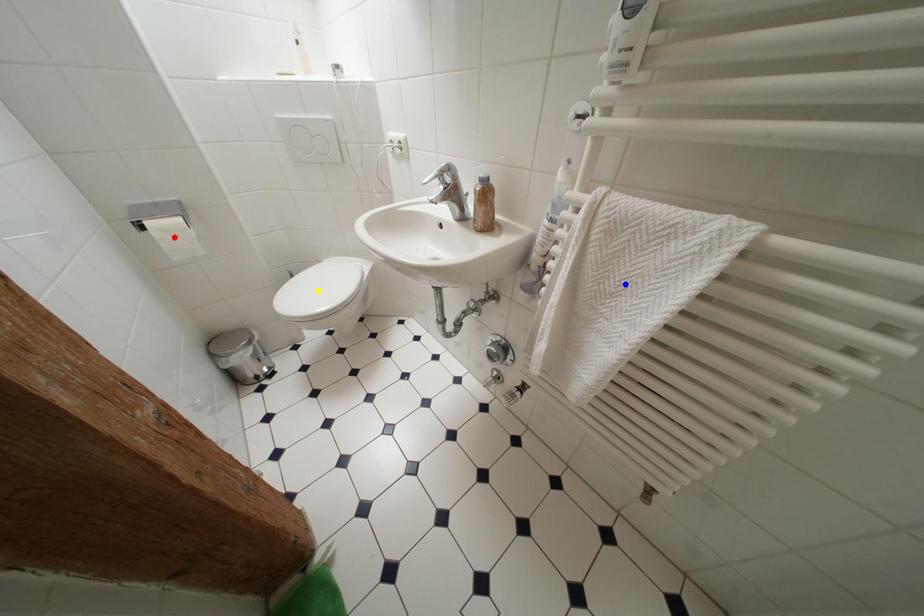
Order these from nearest to farthest:
blue point | yellow point | red point

blue point < red point < yellow point